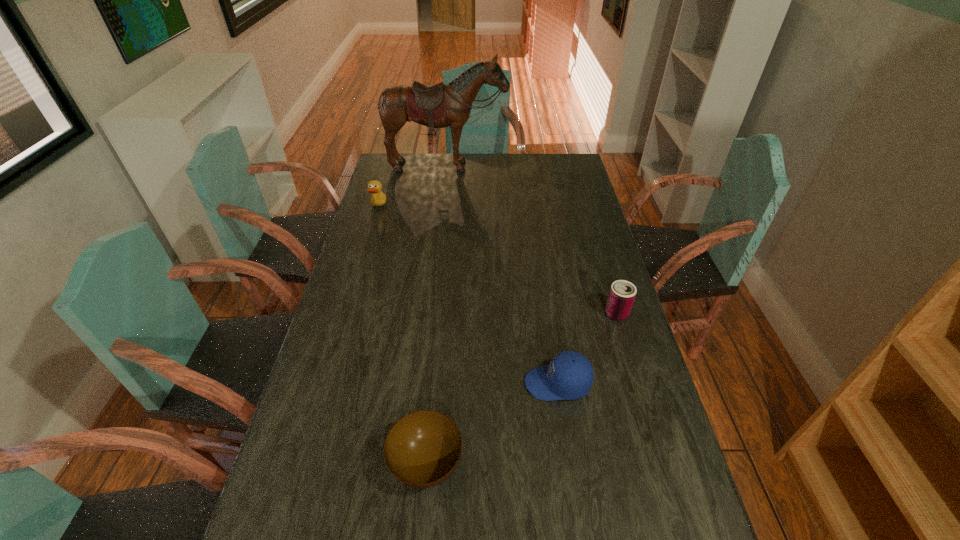
At what (x,y) coordinates should I click in order to perform the action: click on vacant space that satisfies the following two spatial constraints: 1. on the beak of the can; 2. on the left side of the fourth nearest object. Please return your answer as a coordinate pair (x, y). This screenshot has height=540, width=960. Looking at the image, I should click on (347, 314).

This screenshot has height=540, width=960. Find the location of `free space that satisfies the following two spatial constraints: 1. on the beak of the second farthest object; 2. on the left side of the rightmost object`. free space that satisfies the following two spatial constraints: 1. on the beak of the second farthest object; 2. on the left side of the rightmost object is located at coordinates (347, 314).